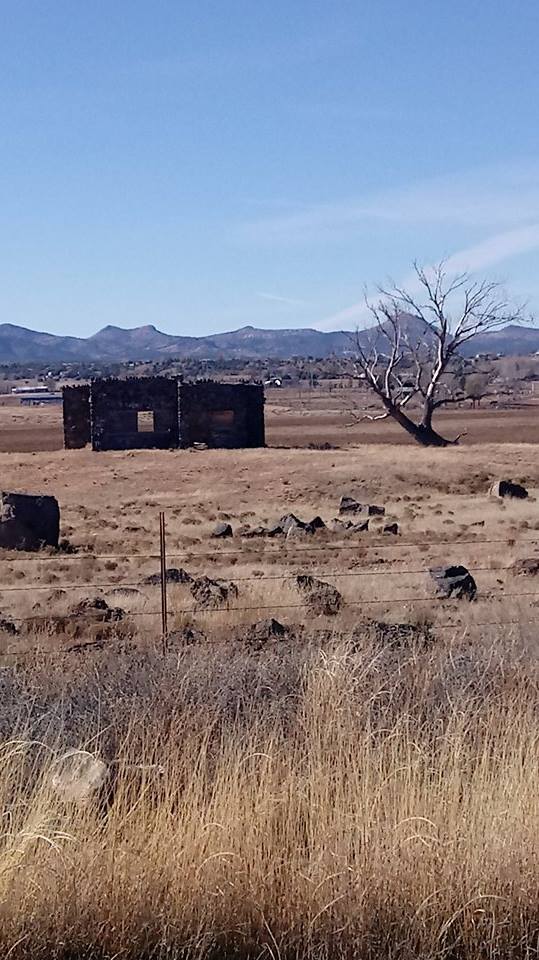
The image size is (539, 960). In order to click on window in this screenshot , I will do `click(143, 425)`.